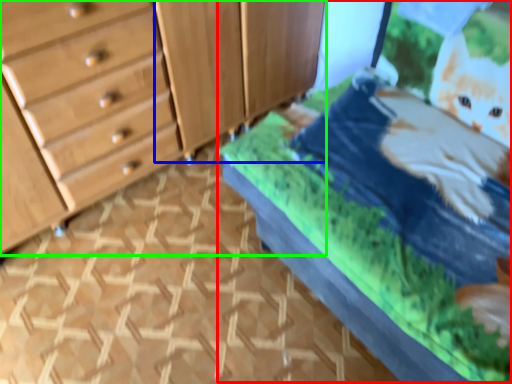
Question: Which object is positioned closest to bed (highlighted by a red box)? Select from cabinetry (highlighted by a blue box) and chest of drawers (highlighted by a green box).

Choices:
 (A) cabinetry
 (B) chest of drawers

Answer: (A)